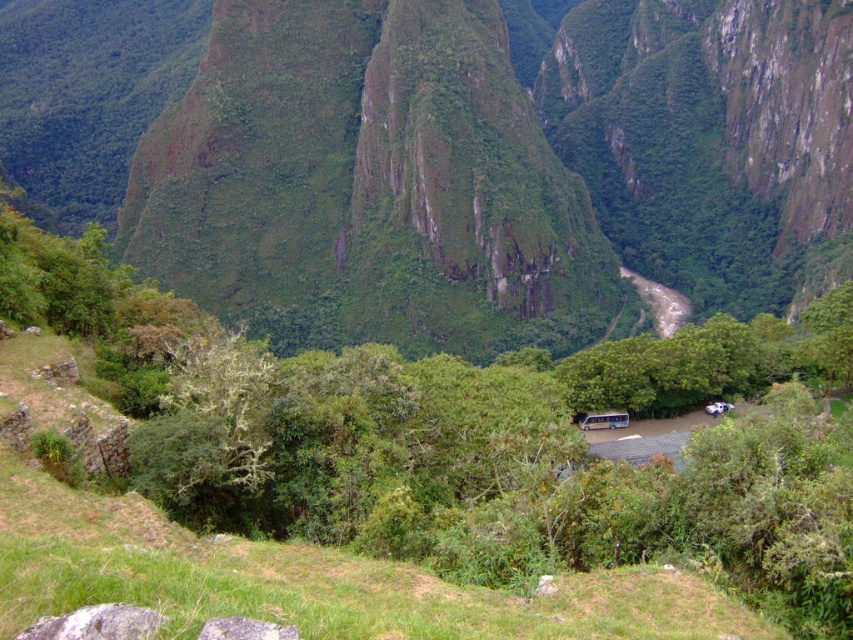
Question: Does green leafy trees at center have a smaller size compared to brown rocky river at center?

Choices:
 (A) yes
 (B) no

Answer: (B)

Question: Can you confirm if green leafy trees at center is smaller than brown rocky river at center?

Choices:
 (A) yes
 (B) no

Answer: (B)

Question: Considering the relative positions of green leafy trees at center and brown rocky river at center in the image provided, where is green leafy trees at center located with respect to brown rocky river at center?

Choices:
 (A) below
 (B) above

Answer: (A)

Question: Which point appears closest to the camera in this image?

Choices:
 (A) (656, 284)
 (B) (199, 364)

Answer: (B)

Question: Which point is closer to the camera?

Choices:
 (A) (38, 400)
 (B) (660, 300)

Answer: (A)